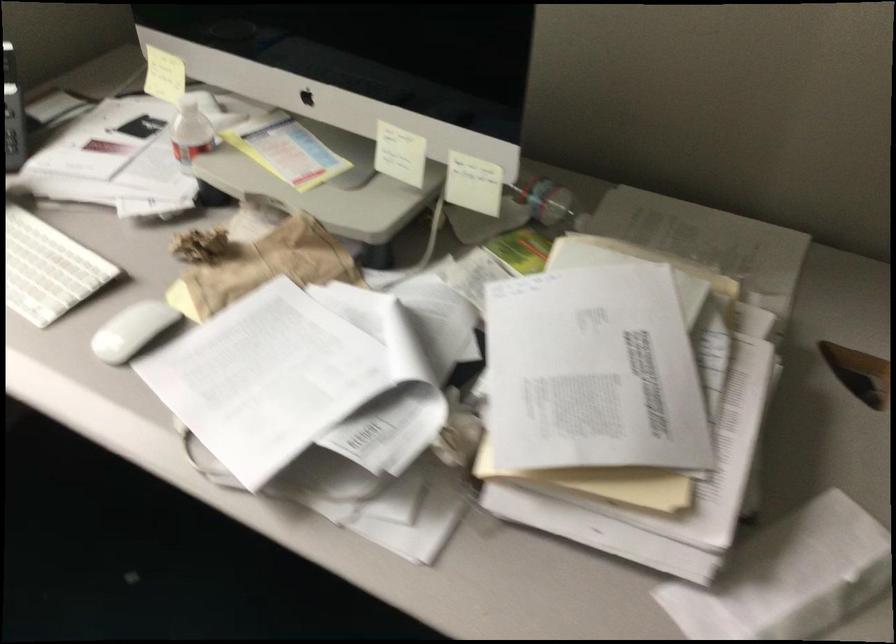
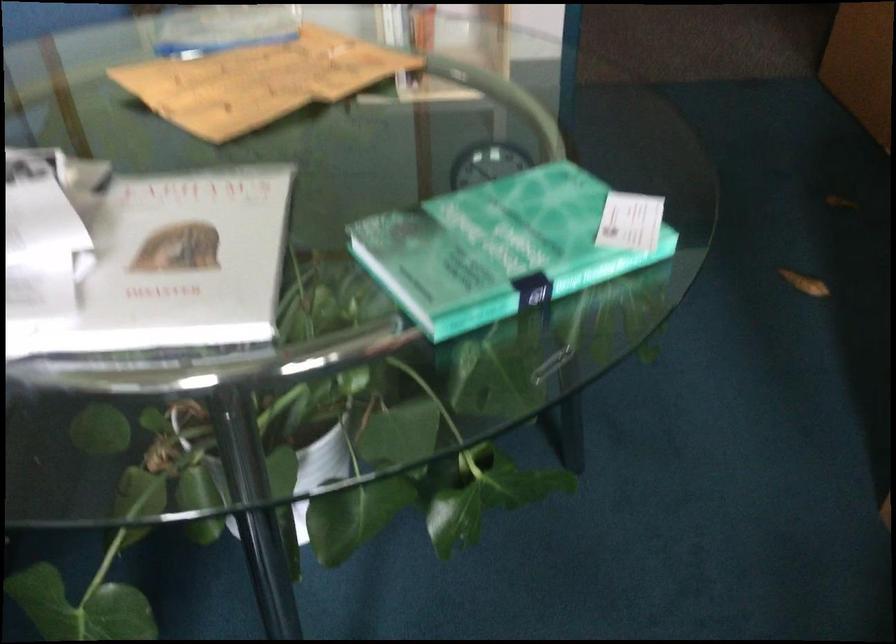
How did the camera likely rotate?

The camera's rotation is toward right-down.